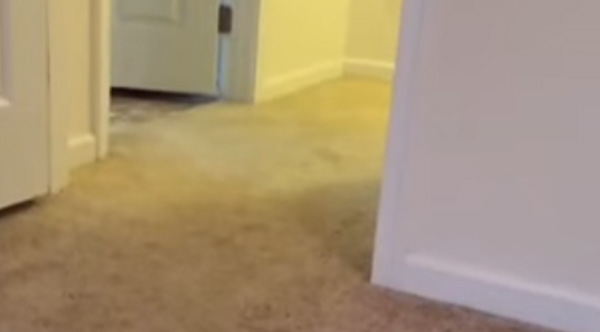
Where is `doors`? doors is located at coordinates 166,23, 27,152.